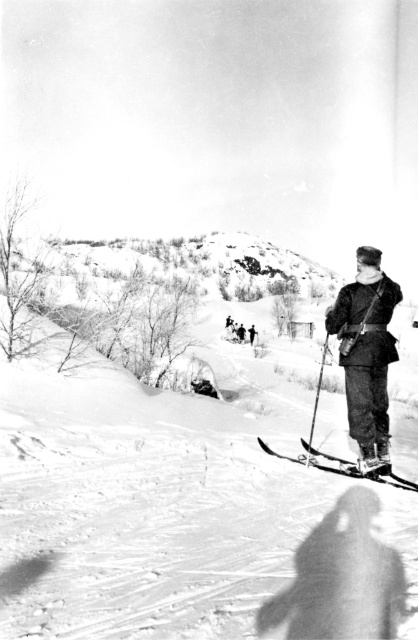
Is dark woolen coat at right smaller than metallic skis at center?

Correct, dark woolen coat at right occupies less space than metallic skis at center.

Is point (389, 358) behind point (343, 460)?

No, it is not.

At what (x,y) coordinates should I click in order to perform the action: click on dark woolen coat at right. Please return your answer as a coordinate pair (x, y). This screenshot has height=640, width=418. Looking at the image, I should click on (367, 353).

Can you confirm if white powder snow at center is wider than metallic skis at center?

Yes, white powder snow at center is wider than metallic skis at center.

Is white powder snow at center positioned at the back of metallic skis at center?

No.

Is point (288, 440) closer to viewer compared to point (407, 490)?

No, (288, 440) is behind (407, 490).

Image resolution: width=418 pixels, height=640 pixels. Find the location of `white powder snow at center`. white powder snow at center is located at coordinates (185, 513).

Between white powder snow at center and dark woolen coat at right, which one is positioned higher?

dark woolen coat at right is higher up.

Which is behind, point (349, 582) or point (354, 346)?

Positioned behind is point (354, 346).

The image size is (418, 640). I want to click on white powder snow at center, so click(185, 513).